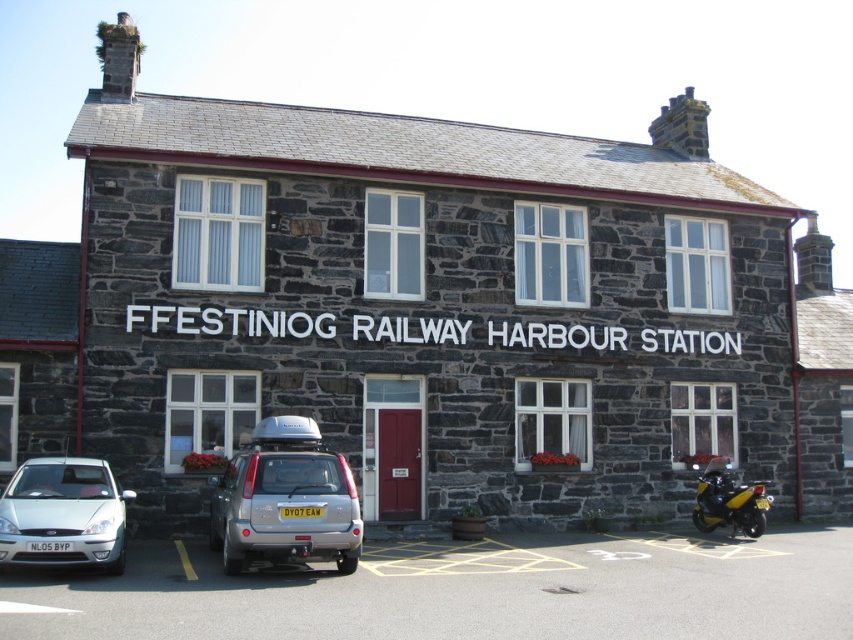
Question: Considering the relative positions of silver metallic car at center and yellow metallic license plate at center in the image provided, where is silver metallic car at center located with respect to yellow metallic license plate at center?

Choices:
 (A) left
 (B) right

Answer: (A)

Question: Estimate the real-world distances between objects in this image. Which object is closer to the smooth asphalt parking lot at lower center?

Choices:
 (A) white plastic license plate at center
 (B) silver metallic car at lower left
 (C) silver metallic car at center
 (D) yellow matte motorcycle at lower right

Answer: (C)

Question: Which point appears closest to the camera in this image?

Choices:
 (A) (699, 508)
 (B) (111, 570)

Answer: (B)

Question: Considering the real-world distances, which object is farthest from the smooth asphalt parking lot at lower center?

Choices:
 (A) yellow metallic license plate at center
 (B) silver metallic car at center

Answer: (A)

Question: Can you confirm if silver metallic car at center is thinner than silver metallic car at lower left?

Choices:
 (A) yes
 (B) no

Answer: (B)

Question: Can you confirm if yellow matte motorcycle at lower right is positioned to the right of white plastic license plate at center?

Choices:
 (A) yes
 (B) no

Answer: (A)